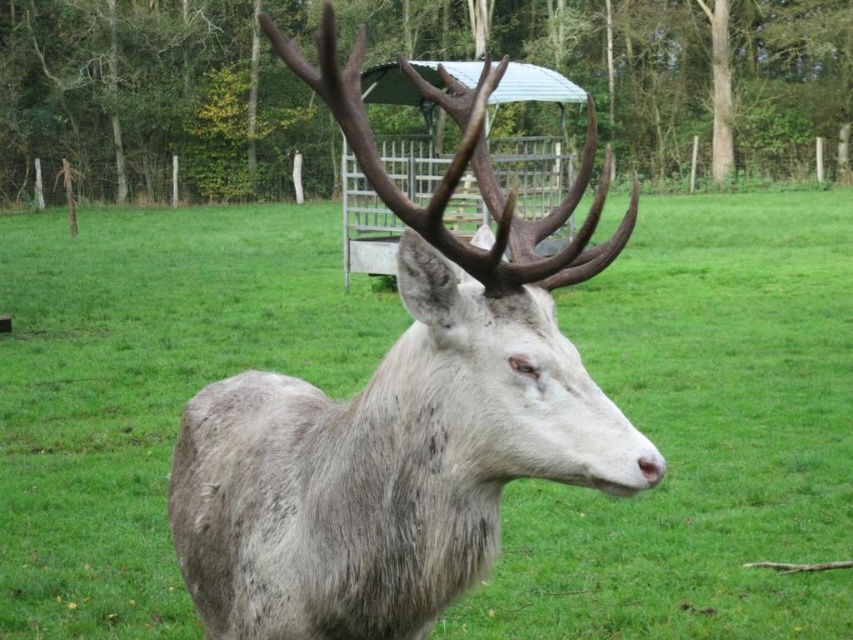
You are a wildlife photographer aiming to capture the deer in the image. You notice the fuzzy gray deer at center and the gray matte fur at center. Which part of the deer should you focus on if you want to highlight its textured fur?

The gray matte fur at center is below the fuzzy gray deer at center, so focusing on the fuzzy gray deer at center would better highlight the textured fur since it is positioned above the matte fur.

You are a painter observing the deer scene. You want to paint the gray matte fur at center first before moving on to the fuzzy gray deer at center. Based on their positions, is this possible without needing to repaint the fur later?

The gray matte fur at center is behind the fuzzy gray deer at center, so you can paint the gray matte fur at center first and then paint the fuzzy gray deer at center on top of it without needing to repaint the fur later.

You are a wildlife photographer trying to capture the deer in the image. You notice two parts of the deer with different textures. Which part is located to the left of the other? The fuzzy gray deer at center and the gray matte fur at center are both visible. Please identify which one is to the left.

The fuzzy gray deer at center is to the left of the gray matte fur at center.